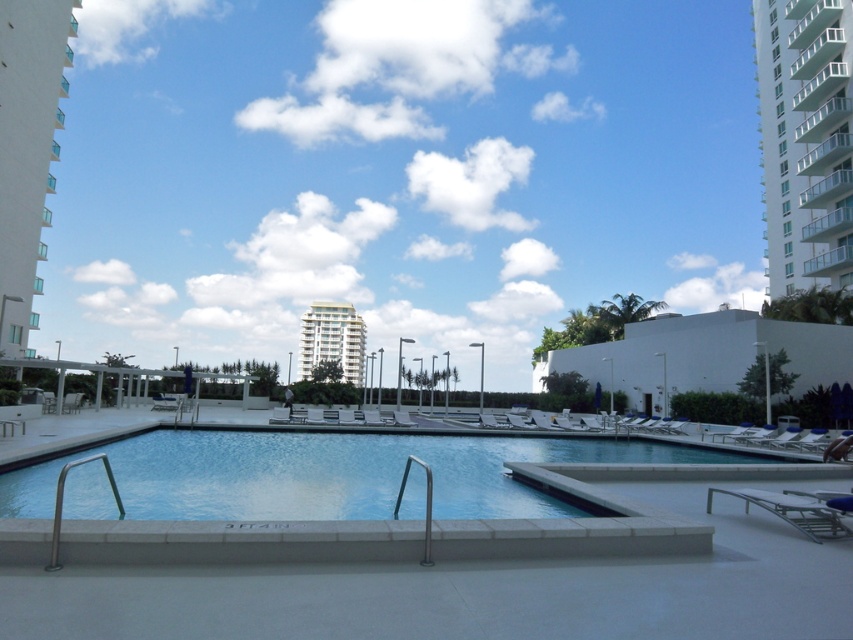
In the scene shown: Who is positioned more to the left, white concrete building at upper right or white glossy building at center?

white glossy building at center is more to the left.

Between white concrete building at upper right and white glossy building at center, which one is positioned higher?

white concrete building at upper right is above.

Is point (846, 212) in front of point (357, 365)?

Yes, it is in front of point (357, 365).

Where is `white concrete building at upper right`? white concrete building at upper right is located at coordinates (805, 140).

Is point (119, 452) closer to camera compared to point (358, 380)?

Yes, it is.

I want to click on clear glass pool at center, so click(x=328, y=474).

Consider the image. Between clear glass pool at center and white glass building at left, which one appears on the left side from the viewer's perspective?

From the viewer's perspective, white glass building at left appears more on the left side.

Is clear glass pool at center thinner than white glass building at left?

Yes, clear glass pool at center is thinner than white glass building at left.

Locate an element on the screen. clear glass pool at center is located at coordinates [328, 474].